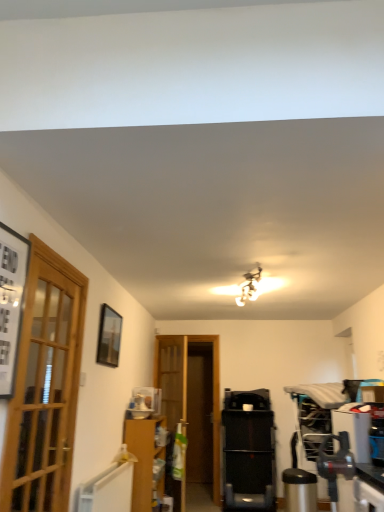
Question: From a real-world perspective, relative to black matte picture frame at left, the 1th picture frame in the left-to-right sequence, is black plastic treadmill at center vertically above or below?

Choices:
 (A) above
 (B) below

Answer: (B)

Question: In terms of width, does black plastic treadmill at center look wider or thinner when compared to black matte picture frame at left, the 1th picture frame in the left-to-right sequence?

Choices:
 (A) wide
 (B) thin

Answer: (A)

Question: Considering the real-world distances, which object is farthest from the black plastic treadmill at center?

Choices:
 (A) black matte picture frame at left, positioned as the second picture frame in right-to-left order
 (B) brown cardboard cabinet at lower left
 (C) matte black picture frame at upper left, which appears as the 1th picture frame when viewed from the right
 (D) wooden door at center, the 2th door from the left
 (E) wooden glass door at left, which is counted as the 1th door, starting from the left

Answer: (A)

Question: Which object is the farthest from the brown cardboard cabinet at lower left?

Choices:
 (A) wooden glass door at left, which is counted as the 1th door, starting from the left
 (B) black plastic treadmill at center
 (C) matte black picture frame at upper left, which is counted as the second picture frame, starting from the front
 (D) wooden door at center, marked as the second door in a front-to-back arrangement
 (E) black matte picture frame at left, which is counted as the 1th picture frame, starting from the front

Answer: (E)